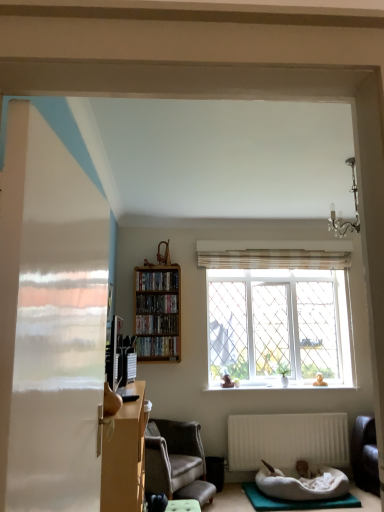
Question: Is there a large distance between matte brown desk at left and wooden shelf at upper center, acting as the fourth book starting from the bottom?

Choices:
 (A) yes
 (B) no

Answer: (A)

Question: Does matte brown desk at left have a smaller size compared to wooden shelf at upper center, acting as the fourth book starting from the bottom?

Choices:
 (A) yes
 (B) no

Answer: (B)

Question: Does matte brown desk at left lie behind wooden shelf at upper center, the 1th book in the top-to-bottom sequence?

Choices:
 (A) yes
 (B) no

Answer: (B)

Question: From the image's perspective, would you say matte brown desk at left is positioned over wooden shelf at upper center, the 1th book in the top-to-bottom sequence?

Choices:
 (A) no
 (B) yes

Answer: (A)

Question: Does matte brown desk at left appear on the right side of wooden shelf at upper center, the 1th book in the top-to-bottom sequence?

Choices:
 (A) no
 (B) yes

Answer: (A)

Question: Based on their sizes in the image, would you say wooden bookshelf at center is bigger or smaller than teal fabric yoga mat at lower right?

Choices:
 (A) big
 (B) small

Answer: (A)

Question: Which is correct: wooden bookshelf at center is inside teal fabric yoga mat at lower right, or outside of it?

Choices:
 (A) outside
 (B) inside

Answer: (A)

Question: Is wooden bookshelf at center in front of or behind teal fabric yoga mat at lower right in the image?

Choices:
 (A) front
 (B) behind

Answer: (B)

Question: From a real-world perspective, relative to teal fabric yoga mat at lower right, is wooden bookshelf at center vertically above or below?

Choices:
 (A) above
 (B) below

Answer: (A)

Question: From a real-world perspective, relative to matte brown desk at left, is white matte radiator at lower center vertically above or below?

Choices:
 (A) below
 (B) above

Answer: (A)

Question: Relative to matte brown desk at left, is white matte radiator at lower center in front or behind?

Choices:
 (A) behind
 (B) front

Answer: (A)

Question: In terms of width, does white matte radiator at lower center look wider or thinner when compared to matte brown desk at left?

Choices:
 (A) thin
 (B) wide

Answer: (A)

Question: Based on their positions, is white matte radiator at lower center located to the left or right of matte brown desk at left?

Choices:
 (A) right
 (B) left

Answer: (A)

Question: Considering the positions of matte brown desk at left and wooden shelf at upper center, acting as the fourth book starting from the bottom, in the image, is matte brown desk at left bigger or smaller than wooden shelf at upper center, acting as the fourth book starting from the bottom,?

Choices:
 (A) small
 (B) big

Answer: (B)

Question: Considering the positions of matte brown desk at left and wooden shelf at upper center, acting as the fourth book starting from the bottom, in the image, is matte brown desk at left wider or thinner than wooden shelf at upper center, acting as the fourth book starting from the bottom,?

Choices:
 (A) thin
 (B) wide

Answer: (B)